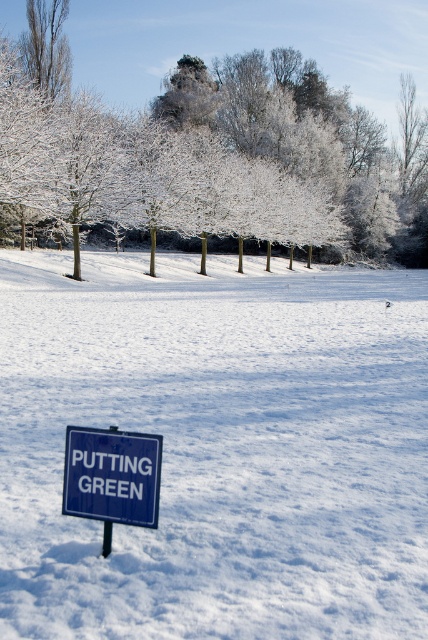
You are a delivery robot trying to navigate through the snow. You see the blue plastic sign at lower left and the metallic pole at lower center. Which object is larger in size?

The blue plastic sign at lower left is bigger than the metallic pole at lower center.

You are a snowplow operator trying to clear the snow from the road. You see the white powdery snow at center and the metallic pole at lower center. Which object is higher in the image?

The white powdery snow at center is located above the metallic pole at lower center, so it is higher in the image.

Based on the coordinates provided, what object is located at point [276,104] in the winter scene?

The point [276,104] marks the location of a white frosty tree at center.